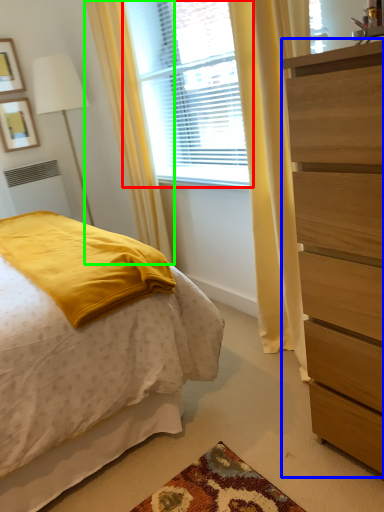
Question: Which object is positioned farthest from window (highlighted by a red box)? Select from chest of drawers (highlighted by a blue box) and curtain (highlighted by a green box).

Choices:
 (A) chest of drawers
 (B) curtain

Answer: (A)